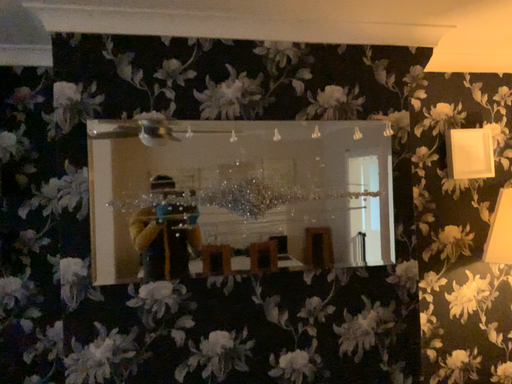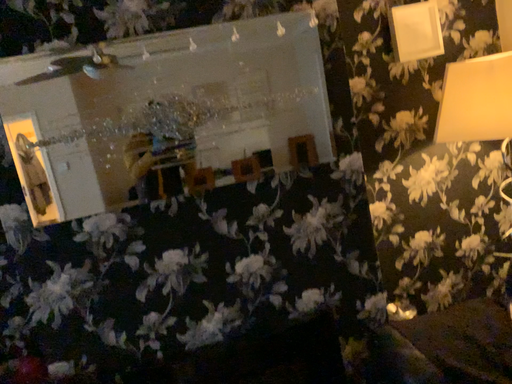
Question: How did the camera likely rotate when shooting the video?

Choices:
 (A) rotated upward
 (B) rotated downward

Answer: (B)